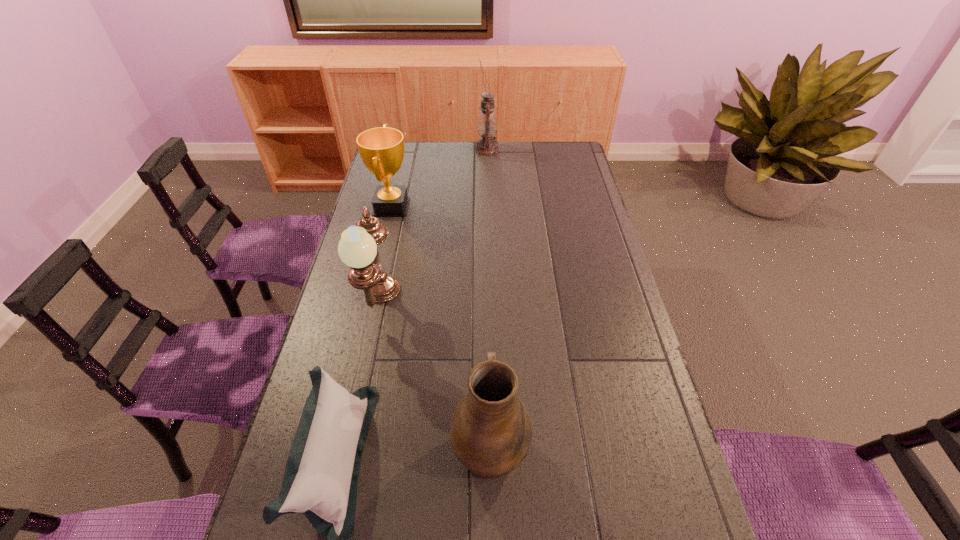
Find the location of `the second closest object to the right oil lamp`. the second closest object to the right oil lamp is located at coordinates (357, 248).

This screenshot has width=960, height=540. In order to click on object that stands as the fourth closest to the award in this screenshot , I will do `click(491, 433)`.

The image size is (960, 540). In order to click on free spot that satisfies the following two spatial constraints: 1. on the handle side of the pitcher; 2. on the front-facing side of the award in this screenshot , I will do `click(486, 207)`.

The image size is (960, 540). Identify the location of free space that satisfies the following two spatial constraints: 1. on the front-facing side of the fourth nearest object; 2. on the handle side of the pitcher. (335, 445).

This screenshot has height=540, width=960. Find the location of `vacant position in the image that satisfies the following two spatial constraints: 1. on the front-facing side of the second farthest object; 2. on the left side of the third nearest object`. vacant position in the image that satisfies the following two spatial constraints: 1. on the front-facing side of the second farthest object; 2. on the left side of the third nearest object is located at coordinates (369, 305).

This screenshot has width=960, height=540. Identify the location of blank space that satisfies the following two spatial constraints: 1. on the handle side of the pitcher; 2. on the front-facing side of the fourth nearest object. (486, 207).

You are a GUI agent. You are given a task and a screenshot of the screen. Output one action in this format:
    pyautogui.click(x=<x>, y=<y>)
    Task: Click on the vacant space that satisfies the following two spatial constraints: 1. on the front-facing side of the third farthest object; 2. on the left side of the award
    The height and width of the screenshot is (540, 960).
    Given the screenshot: What is the action you would take?
    pyautogui.click(x=369, y=305)